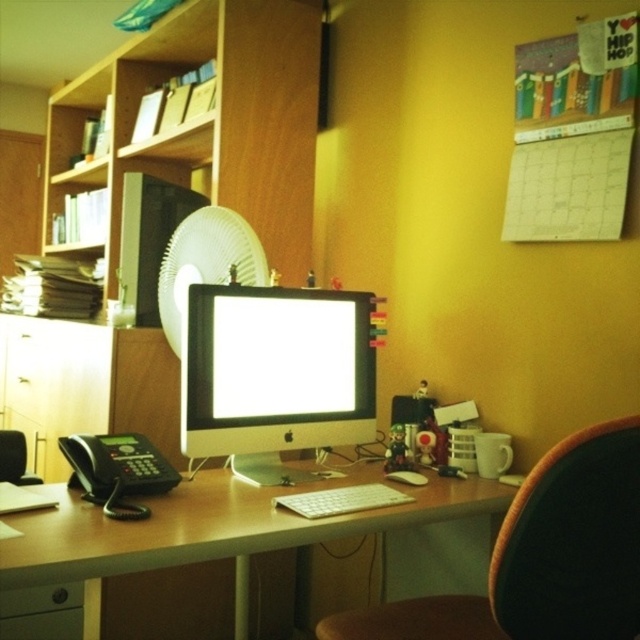
Between white plastic computer desk at center and satin silver monitor at center, which one appears on the left side from the viewer's perspective?

Positioned to the left is white plastic computer desk at center.

Is white plastic computer desk at center thinner than satin silver monitor at center?

No.

The image size is (640, 640). I want to click on white plastic computer desk at center, so click(x=205, y=532).

Can you confirm if white plastic computer desk at center is smaller than brushed metal drawer at lower left?

No.

Which is above, white plastic computer desk at center or brushed metal drawer at lower left?

white plastic computer desk at center is above.

At what (x,y) coordinates should I click in order to perform the action: click on white plastic computer desk at center. Please return your answer as a coordinate pair (x, y). Looking at the image, I should click on (205, 532).

In the scene shown: Is the position of white plastic fan at center more distant than that of black leather chair at left?

No, it is not.

The width and height of the screenshot is (640, 640). I want to click on white plastic fan at center, so click(205, 262).